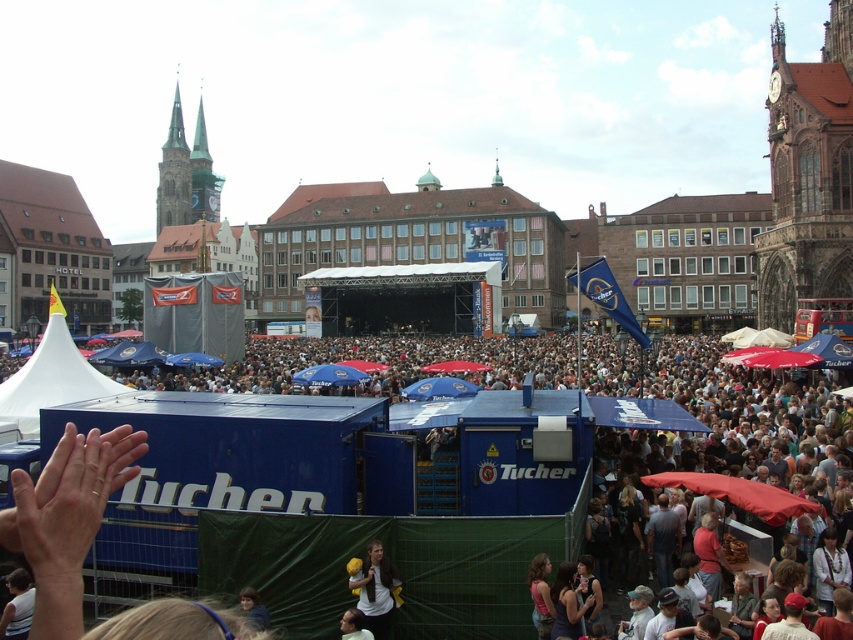
Is brown leather jacket at lower center behind blue fabric umbrella at center?

That is False.

Can you confirm if brown leather jacket at lower center is bigger than blue fabric umbrella at center?

No.

This screenshot has width=853, height=640. What do you see at coordinates (376, 589) in the screenshot?
I see `brown leather jacket at lower center` at bounding box center [376, 589].

Image resolution: width=853 pixels, height=640 pixels. What are the coordinates of `brown leather jacket at lower center` in the screenshot? It's located at (376, 589).

Which is more to the right, brown leather jacket at lower center or smooth skin face at lower center?

From the viewer's perspective, brown leather jacket at lower center appears more on the right side.

Locate an element on the screen. brown leather jacket at lower center is located at coordinates (376, 589).

Which is more to the right, blue fabric umbrella at center or smooth skin face at lower center?

From the viewer's perspective, smooth skin face at lower center appears more on the right side.

Which is below, blue fabric umbrella at center or smooth skin face at lower center?

smooth skin face at lower center is below.

Describe the element at coordinates (329, 376) in the screenshot. I see `blue fabric umbrella at center` at that location.

Identify the location of blue fabric umbrella at center. (329, 376).